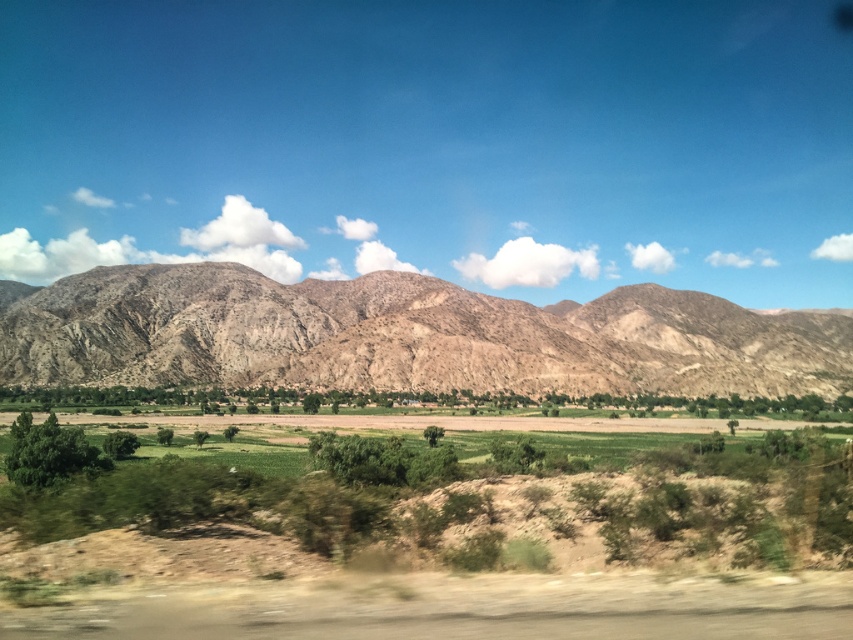
In the scene shown: Who is positioned more to the right, green grassy field at center or brown rocky mountain range at center?

green grassy field at center is more to the right.

How far apart are green grassy field at center and brown rocky mountain range at center?

A distance of 227.43 meters exists between green grassy field at center and brown rocky mountain range at center.

Find the location of a particular element. Image resolution: width=853 pixels, height=640 pixels. green grassy field at center is located at coordinates (445, 557).

Find the location of a particular element. green grassy field at center is located at coordinates (445, 557).